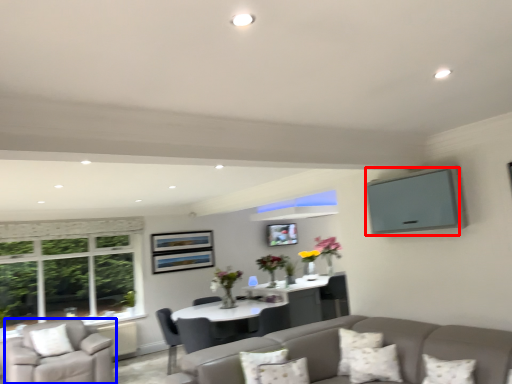
Question: Which object appears closest to the camera in this image, window screen (highlighted by a red box) or chair (highlighted by a blue box)?

Choices:
 (A) window screen
 (B) chair

Answer: (A)